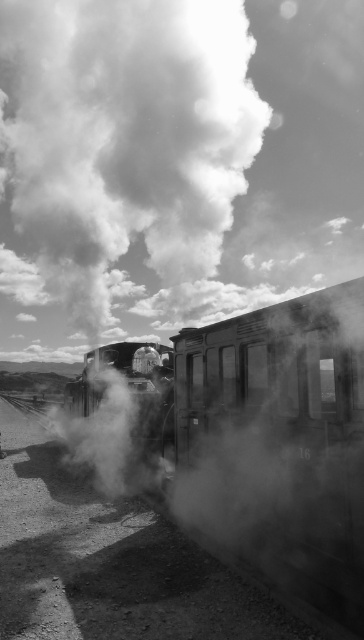
How much distance is there between smooth metal train at center and smooth metal steam engine at center?

smooth metal train at center is 2.50 meters from smooth metal steam engine at center.

Is point (192, 522) farther from viewer compared to point (116, 356)?

No.

Does point (156, 403) come behind point (169, 355)?

No.

Find the location of a particular element. smooth metal train at center is located at coordinates (278, 444).

Which of these two, white smoke at upper center or smooth metal steam engine at center, stands shorter?

With less height is smooth metal steam engine at center.

Is white smoke at upper center wider than smooth metal steam engine at center?

Yes, white smoke at upper center is wider than smooth metal steam engine at center.

Is point (200, 182) less distant than point (84, 397)?

No, (200, 182) is behind (84, 397).

This screenshot has width=364, height=640. Find the location of `white smoke at upper center`. white smoke at upper center is located at coordinates (124, 150).

Is point (8, 241) less distant than point (226, 394)?

That is False.

Which is more to the right, white smoke at upper center or smooth metal train at center?

smooth metal train at center is more to the right.

Describe the element at coordinates (124, 150) in the screenshot. This screenshot has width=364, height=640. I see `white smoke at upper center` at that location.

Identify the location of white smoke at upper center. Image resolution: width=364 pixels, height=640 pixels. (124, 150).